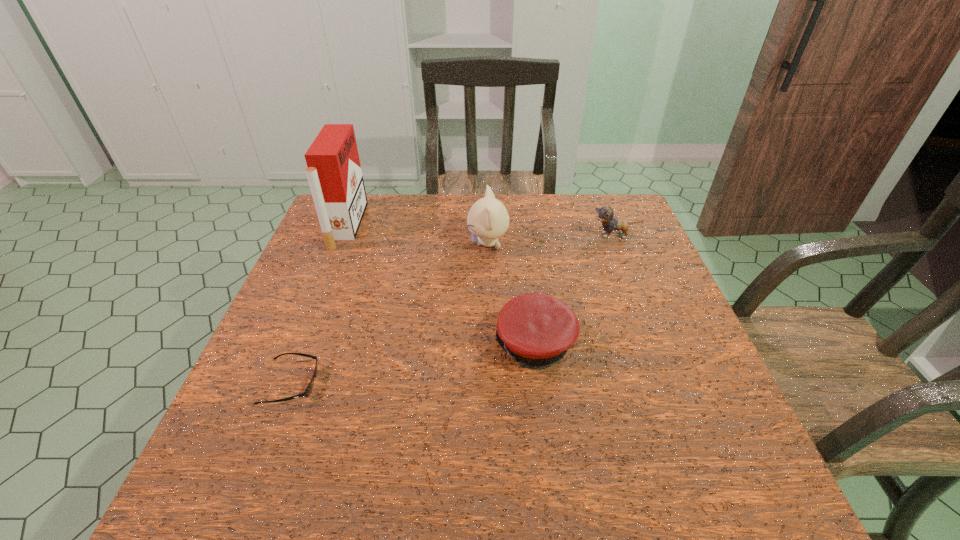
What are the coordinates of `cigarette case` in the screenshot? It's located at (334, 173).

I want to click on the second tallest object, so click(488, 219).

Identify the location of the left kitten. (488, 219).

Image resolution: width=960 pixels, height=540 pixels. I want to click on the right kitten, so click(605, 214).

Locate an element on the screen. the third shortest object is located at coordinates (605, 214).

Find the location of a particular element. the second shortest object is located at coordinates (535, 329).

Find the location of a particular element. The height and width of the screenshot is (540, 960). sunglasses is located at coordinates (307, 392).

You are a GUI agent. You are given a task and a screenshot of the screen. Output one action in this format:
    pyautogui.click(x=<x>, y=<y>)
    Task: Click on the vacant space situated 0.370m on the front-facing side of the tallest object
    The width and height of the screenshot is (960, 540).
    Given the screenshot: What is the action you would take?
    pyautogui.click(x=482, y=225)

Where is `vacant space located 0.130m on the face of the taller kitten`? vacant space located 0.130m on the face of the taller kitten is located at coordinates (422, 243).

Locate an element on the screen. This screenshot has width=960, height=540. vacant space located 0.350m on the face of the taller kitten is located at coordinates (x=346, y=243).